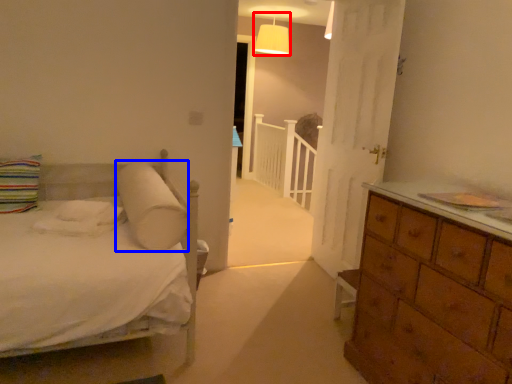
Question: Among these objects, which one is nearest to the camera, lamp (highlighted by a red box) or pillow (highlighted by a blue box)?

Choices:
 (A) lamp
 (B) pillow

Answer: (B)